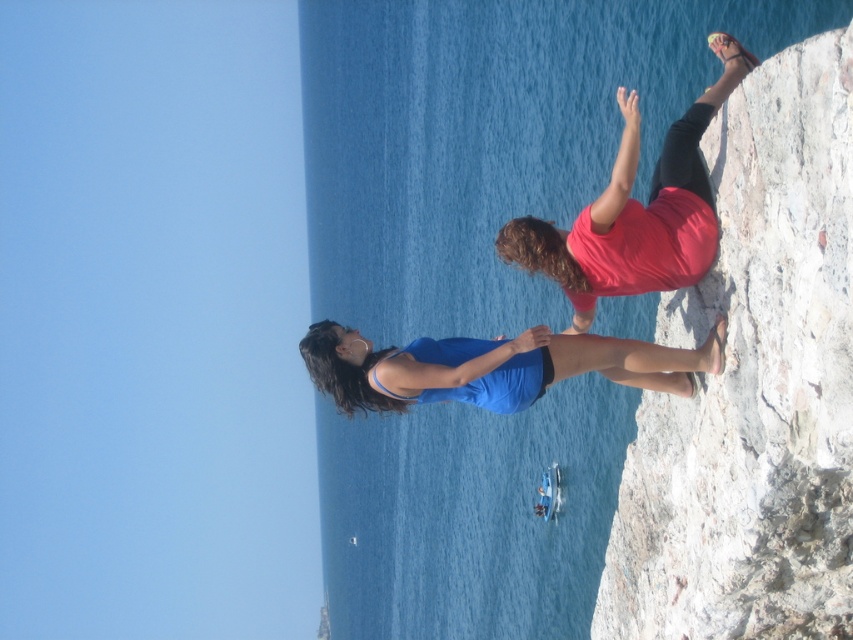
You are a photographer positioned at the base of the rocky outcrop. You want to take a photo of the two people standing on the outcrop. The camera you have can focus on objects up to 25 meters away. Will the matte red shirt at upper right be in focus?

The two people are 24.62 meters apart. Since the camera can focus up to 25 meters, the matte red shirt at upper right will be within the focus range and should be in focus.

You are a photographer planning to take a portrait of the two people in the scene. The matte red shirt at upper right and the blue fabric at center are both visible. Since you want to ensure that the wider object is in focus, which one should you adjust your camera settings for?

The matte red shirt at upper right is wider than the blue fabric at center, so you should adjust your camera settings to focus on the matte red shirt at upper right.